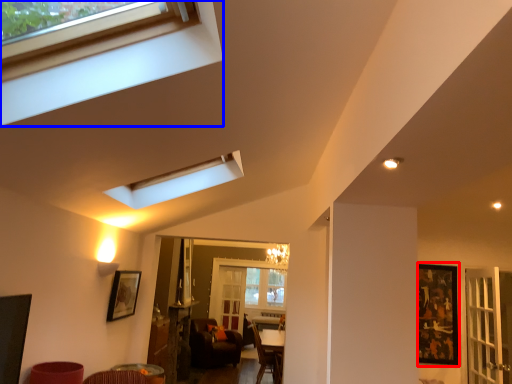
Question: Among these objects, which one is farthest to the camera, picture frame (highlighted by a red box) or window (highlighted by a blue box)?

Choices:
 (A) picture frame
 (B) window

Answer: (A)